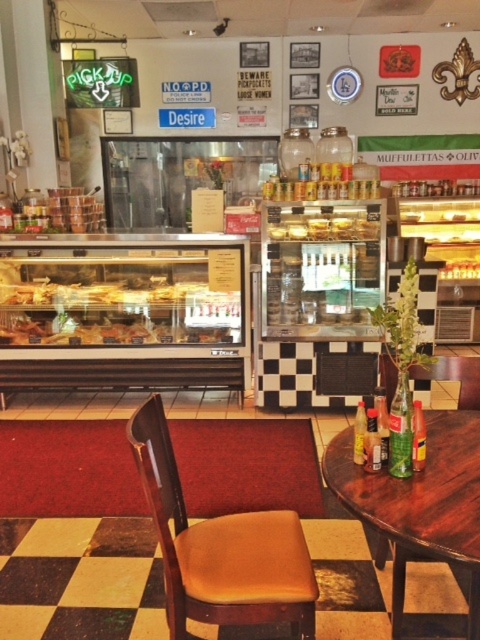
Does brown leather chair at center have a larger size compared to translucent glass pastries at center?

No, brown leather chair at center is not bigger than translucent glass pastries at center.

Between point (215, 605) and point (23, 336), which one is positioned in front?

Positioned in front is point (215, 605).

This screenshot has height=640, width=480. In order to click on brown leather chair at center in this screenshot , I will do `click(220, 547)`.

At what (x,y) coordinates should I click in order to perform the action: click on wooden table at right. Please return your answer as a coordinate pair (x, y). Looking at the image, I should click on (420, 502).

Is wooden table at right smaller than translucent glass pastries at center?

Indeed, wooden table at right has a smaller size compared to translucent glass pastries at center.

Does point (468, 490) lie behind point (41, 298)?

No.

Locate an element on the screen. wooden table at right is located at coordinates (420, 502).

Between brown leather chair at center and wooden table at right, which one has less height?

wooden table at right

Can you confirm if brown leather chair at center is smaller than wooden table at right?

No.

This screenshot has width=480, height=640. Describe the element at coordinates (220, 547) in the screenshot. I see `brown leather chair at center` at that location.

This screenshot has height=640, width=480. In order to click on brown leather chair at center in this screenshot , I will do `click(220, 547)`.